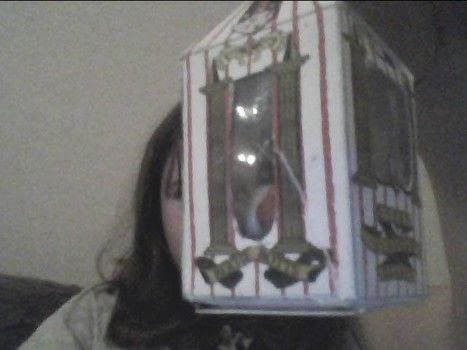
Find the location of a particular element. Image resolution: width=467 pixels, height=350 pixels. box is located at coordinates (242, 11).